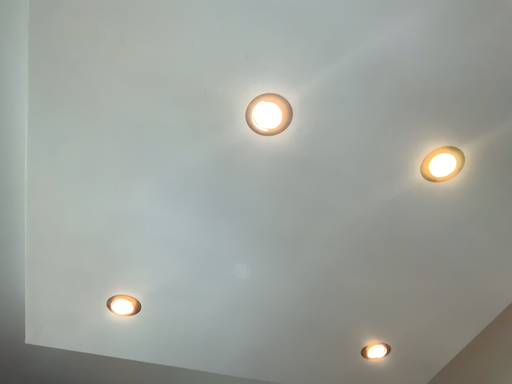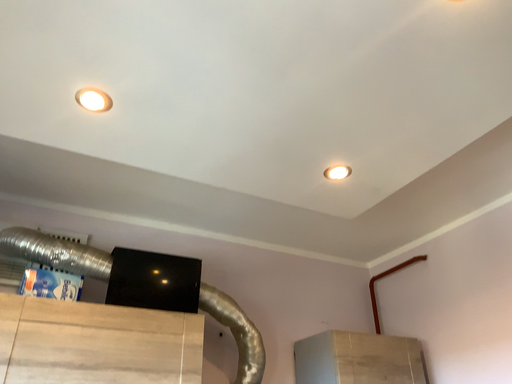
Question: How did the camera likely rotate when shooting the video?

Choices:
 (A) rotated upward
 (B) rotated downward

Answer: (B)